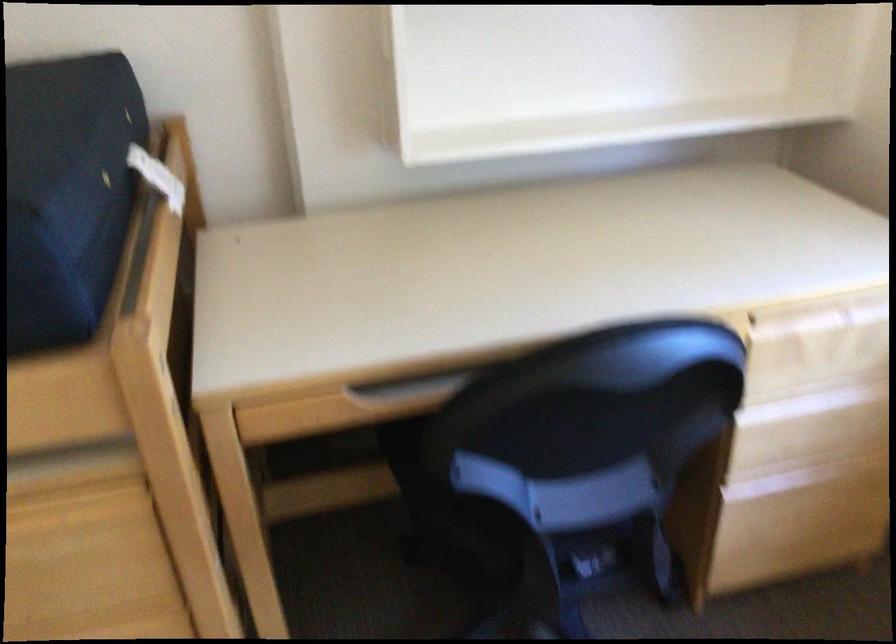
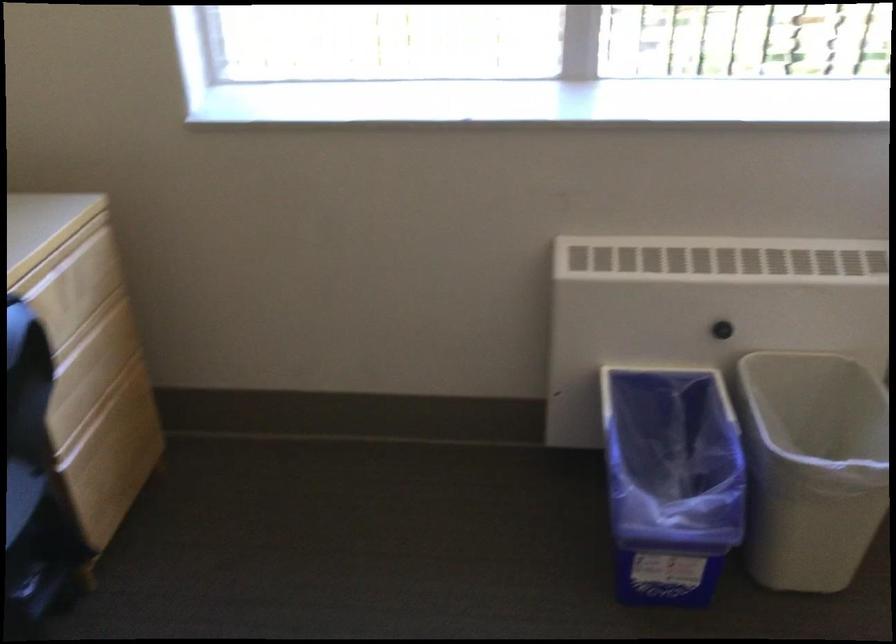
Consider the image. How did the camera likely rotate?

The camera rotated toward right-down.